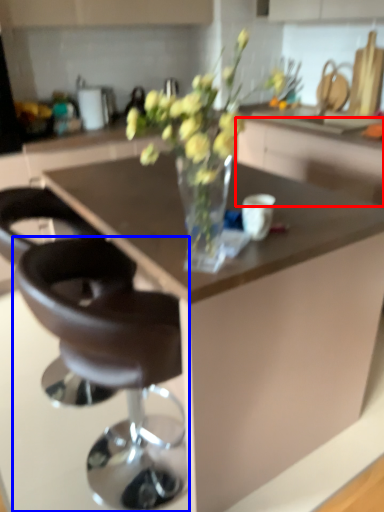
Question: Which of the following is the farthest to the observer, cabinetry (highlighted by a red box) or chair (highlighted by a blue box)?

Choices:
 (A) cabinetry
 (B) chair

Answer: (A)